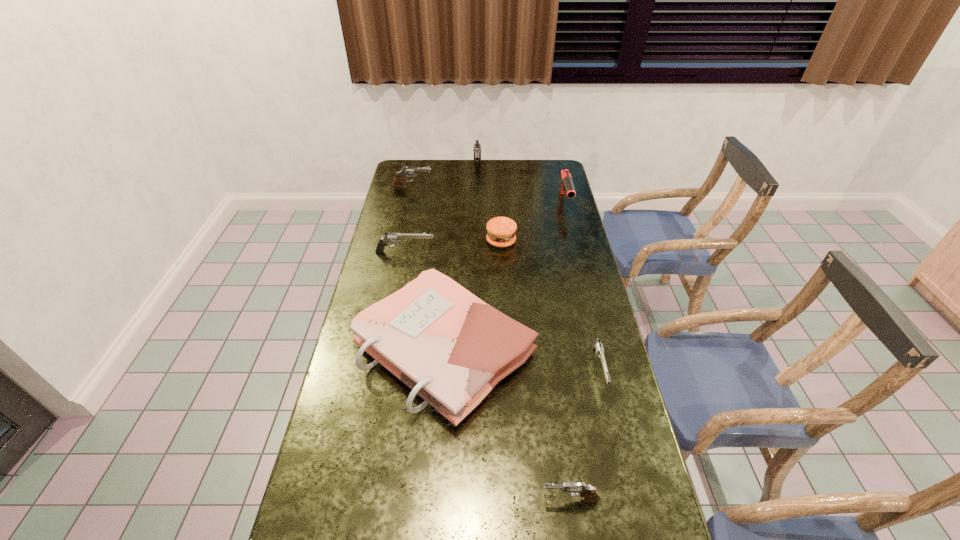
Identify the location of pistol that is the fourth closest to the patty. The image size is (960, 540). (596, 344).

Point out which gray pistol is positioned as the second nearest to the left silver pistol. Please provide its 2D coordinates. Your answer should be formatted as a tuple, i.e. [(x, y)], where the tuple contains the x and y coordinates of a point satisfying the conditions above.

[(477, 147)]

This screenshot has width=960, height=540. Identify the location of gray pistol that is the second closest to the phonebook. (407, 171).

Select which silver pistol is the closest to the gun. Please provide its 2D coordinates. Your answer should be formatted as a tuple, i.e. [(x, y)], where the tuple contains the x and y coordinates of a point satisfying the conditions above.

[(389, 237)]

What are the coordinates of `vacant point that satisfies the following two spatial constraints: 1. on the front-facing side of the third farthest pistol; 2. on the back side of the phonebook` in the screenshot? It's located at (386, 349).